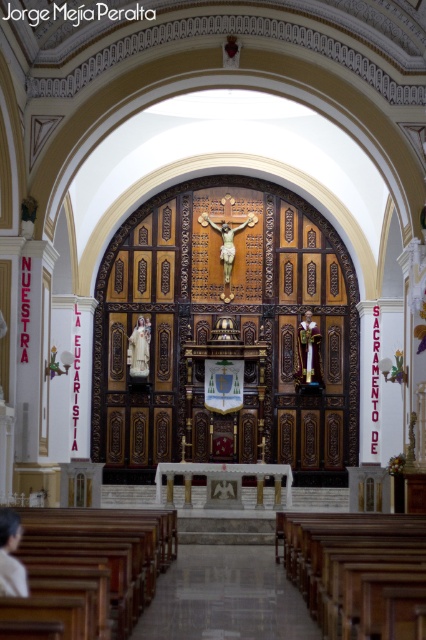
Is smooth skin person at lower left above matte white statue at center?

No, smooth skin person at lower left is not above matte white statue at center.

Does smooth skin person at lower left have a smaller size compared to matte white statue at center?

Actually, smooth skin person at lower left might be larger than matte white statue at center.

Between point (6, 561) and point (141, 323), which one is positioned behind?

The point (141, 323) is behind.

The height and width of the screenshot is (640, 426). I want to click on smooth skin person at lower left, so click(11, 556).

Based on the photo, is matte gold statue at center bigger than wooden crucifix at center?

Indeed, matte gold statue at center has a larger size compared to wooden crucifix at center.

Is matte gold statue at center in front of wooden crucifix at center?

Yes.

Who is more forward, (319, 364) or (227, 225)?

Point (319, 364) is more forward.

The height and width of the screenshot is (640, 426). What are the coordinates of `matte gold statue at center` in the screenshot? It's located at (308, 352).

Can you confirm if matte white statue at center is smaller than wooden crucifix at center?

No.

Who is more distant from viewer, (137, 372) or (227, 266)?

The point (227, 266) is behind.

Identify the location of matte white statue at center. The width and height of the screenshot is (426, 640). (140, 348).